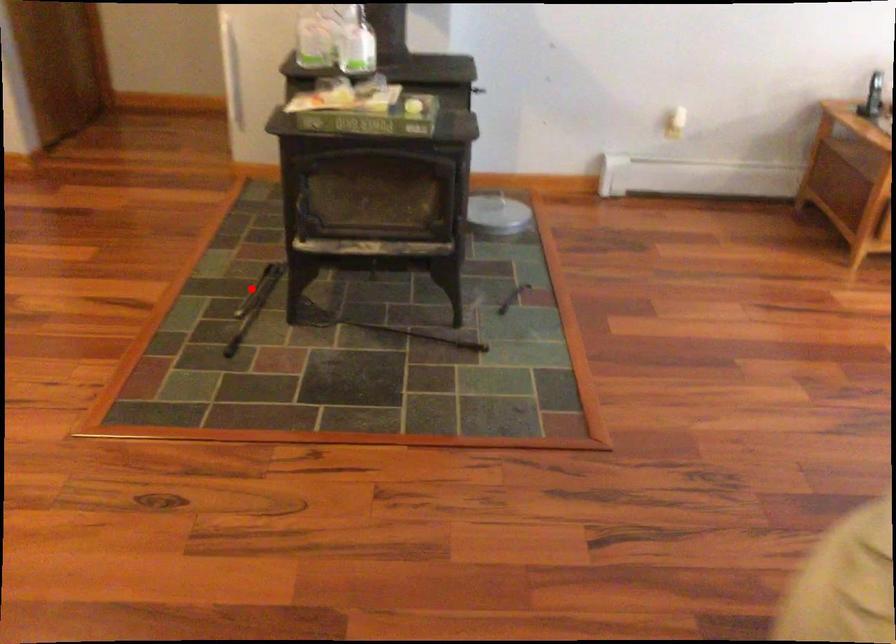
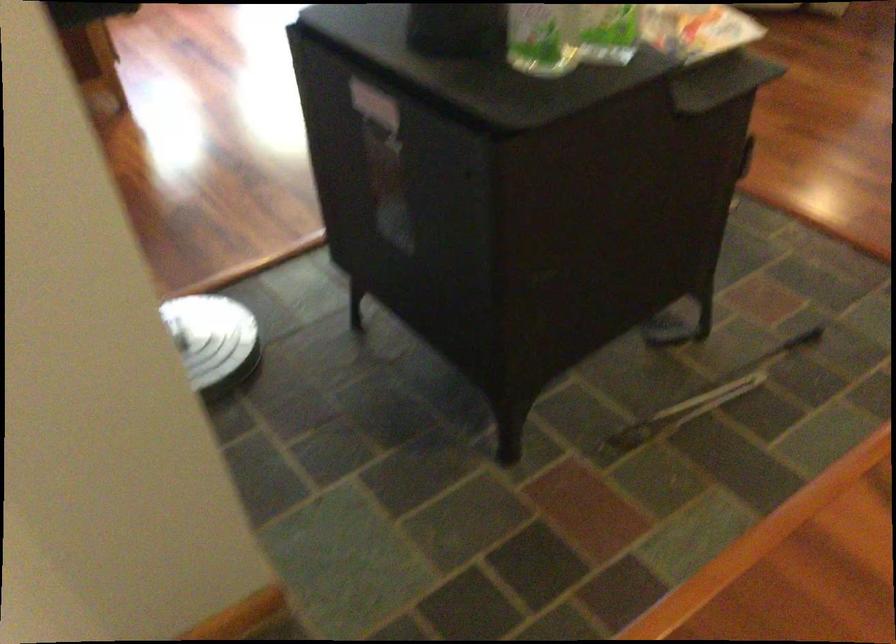
Where in the second image is the point corresponding to the highlighted location from the first image?

(702, 399)